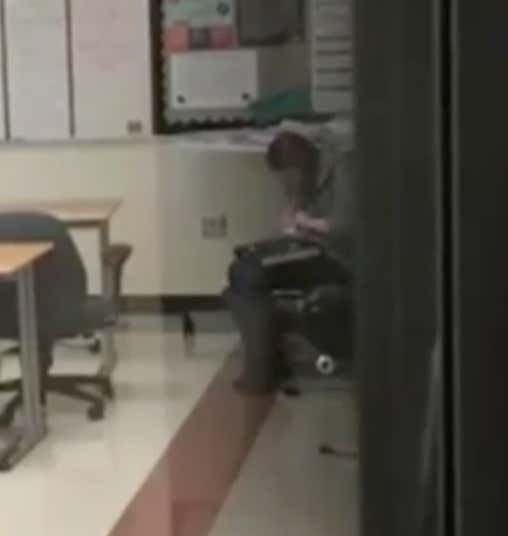
Find the location of a particular element. This screenshot has height=536, width=508. desk is located at coordinates (18, 265), (83, 217).